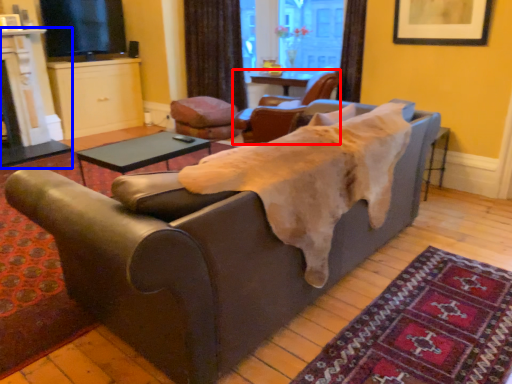
Question: Which object is closer to the camera taking this photo, chair (highlighted by a red box) or fireplace (highlighted by a blue box)?

Choices:
 (A) chair
 (B) fireplace

Answer: (A)